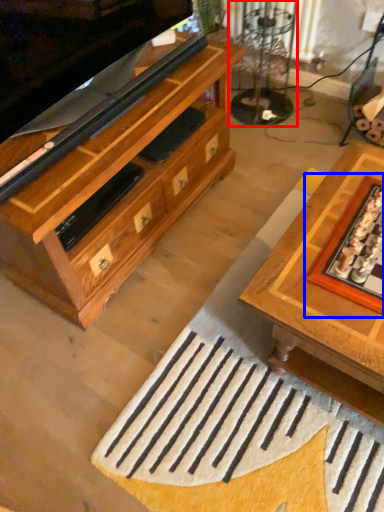
Question: Among these objects, which one is nearest to the camera, glass table (highlighted by a red box) or board game (highlighted by a blue box)?

Choices:
 (A) glass table
 (B) board game

Answer: (B)